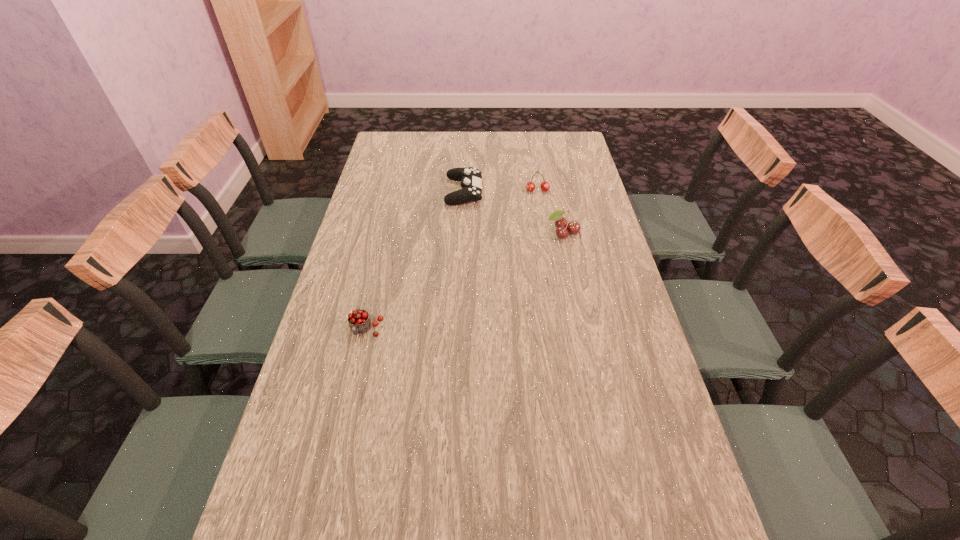
You are a GUI agent. You are given a task and a screenshot of the screen. Output one action in this format:
    pyautogui.click(x=<x>, y=<y>)
    Task: Click on the object that is at the right edge
    The image size is (960, 540).
    Given the screenshot: What is the action you would take?
    pyautogui.click(x=573, y=227)

The height and width of the screenshot is (540, 960). I want to click on vacant space at the far edge, so click(x=487, y=149).

The image size is (960, 540). Identify the location of vacant region at the left edge of the desktop. (328, 375).

In the image, there is a desktop. Where is `blank space at the right edge`? This screenshot has width=960, height=540. blank space at the right edge is located at coordinates (553, 189).

This screenshot has width=960, height=540. In the image, there is a desktop. Identify the location of vacant region at the far right corner. (569, 146).

Where is `free space between the control and the third farthest object`? The width and height of the screenshot is (960, 540). free space between the control and the third farthest object is located at coordinates (514, 212).

Image resolution: width=960 pixels, height=540 pixels. In order to click on vacant space that's between the second nearest cherry and the third object from right to left in this screenshot , I will do `click(514, 212)`.

Identify the location of vacant area between the nearest cherry and the farthest cherry. (451, 260).

You are a GUI agent. You are given a task and a screenshot of the screen. Output one action in this format:
    pyautogui.click(x=<x>, y=<y>)
    Task: Click on the vacant space that is in between the third object from right to left and the second farthest cherry
    
    Given the screenshot: What is the action you would take?
    pyautogui.click(x=514, y=212)

Identify the location of free spot between the control and the second nearest object. (514, 212).